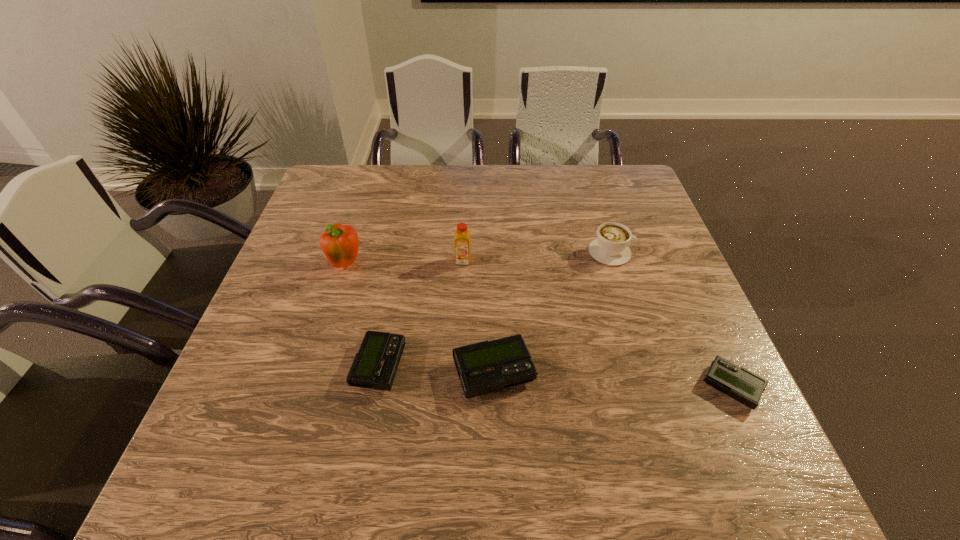
Identify the location of vacant space that satisfies the following two spatial constraints: 1. on the front side of the shortest beeper; 2. on the left side of the leftmost object. (310, 387).

Find the location of a particular element. This screenshot has width=960, height=540. vacant space that satisfies the following two spatial constraints: 1. on the front and back of the rightmost object; 2. on the right side of the fifth shortest object is located at coordinates (458, 387).